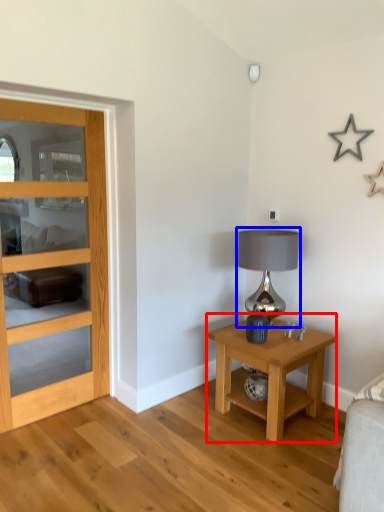
Question: Which object is closer to the camera taking this photo, nightstand (highlighted by a red box) or table lamp (highlighted by a blue box)?

Choices:
 (A) nightstand
 (B) table lamp

Answer: (A)